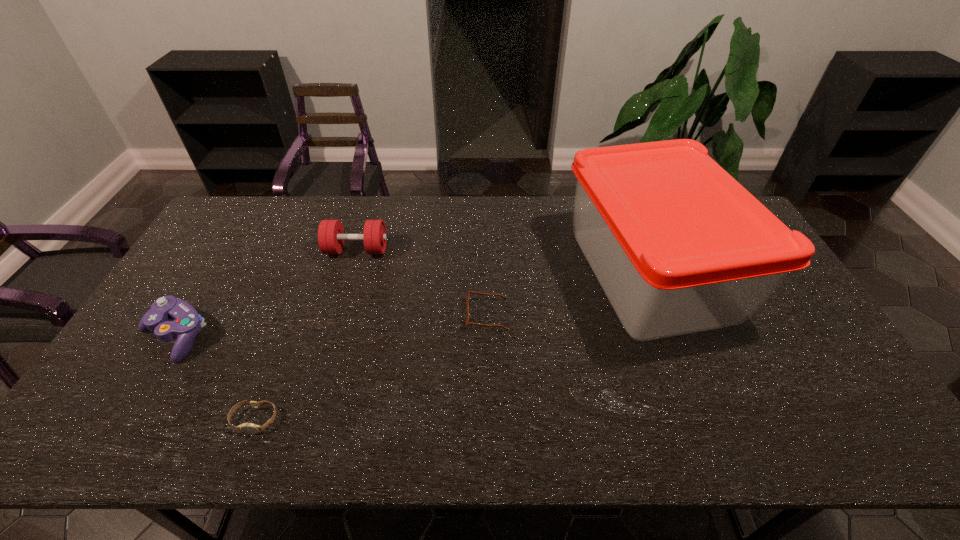
You are a GUI agent. You are given a task and a screenshot of the screen. Output one action in this format:
    pyautogui.click(x=<x>, y=<y>)
    Task: Click on the tray
    The image size is (960, 540).
    Given the screenshot: What is the action you would take?
    pyautogui.click(x=679, y=246)

I want to click on the tallest object, so tap(679, 246).

I want to click on dumbbell, so click(331, 236).

Locate an element on the screen. Image resolution: width=960 pixels, height=540 pixels. control is located at coordinates (187, 323).

Identify the location of the leftmost object. The image size is (960, 540). (187, 323).

Find the location of `the second object from right to left`. the second object from right to left is located at coordinates (467, 322).

Locate an element on the screen. This screenshot has width=960, height=540. the nearest object is located at coordinates (249, 428).

In order to click on vacant space located 0.050m on the back of the tallest object in this screenshot , I will do `click(624, 205)`.

Locate an element on the screen. Image resolution: width=960 pixels, height=540 pixels. vacant space situated on the right of the fourth shortest object is located at coordinates (506, 250).

The height and width of the screenshot is (540, 960). Find the location of `free spot located 0.070m on the right of the third tallest object`. free spot located 0.070m on the right of the third tallest object is located at coordinates (236, 336).